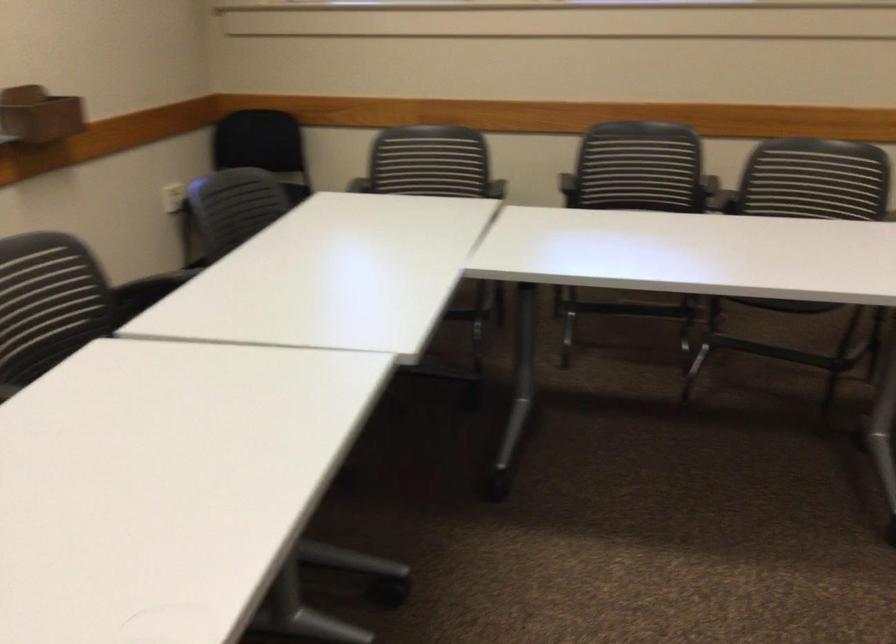
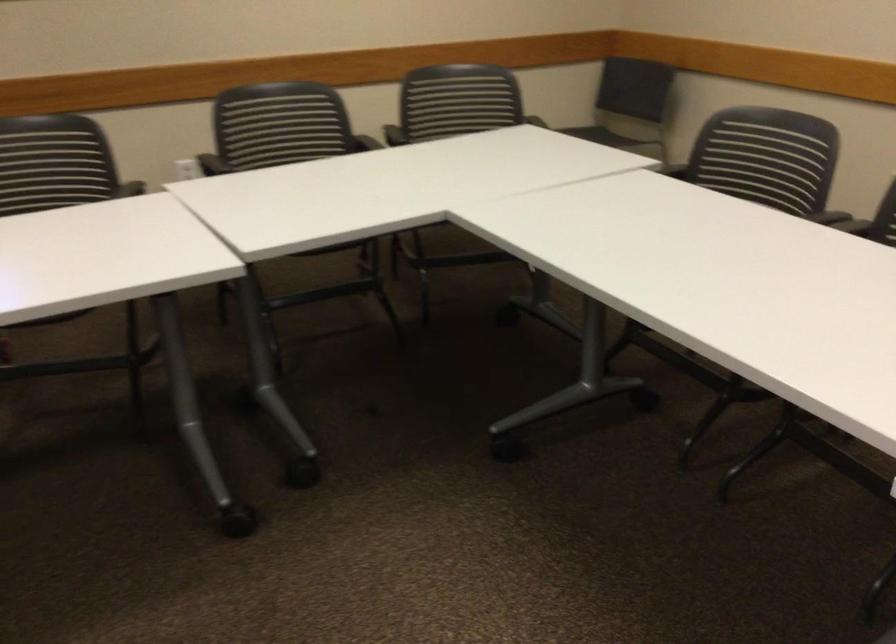
Question: The camera is either moving clockwise (left) or counter-clockwise (right) around the object. The first image is from the beginning of the video and the second image is from the end. Is the camera moving left or right when shooting the video?

Choices:
 (A) Left
 (B) Right

Answer: (A)